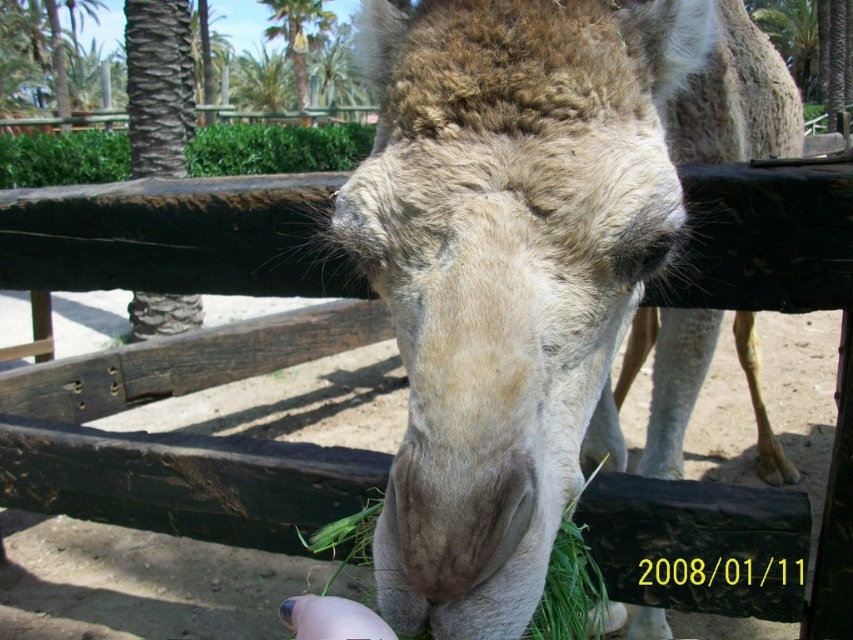
You are standing in front of the camel and want to take a photo. You notice two points marked in the scene. The first point is at coordinate point (495, 403) and the second is at point (318, 0). Which point is closer to your camera?

Point (495, 403) is closer to the camera than point (318, 0).

You are a zookeeper trying to place a new feeding station for the fuzzy beige camel at center. The station needs to be placed 0.3 meters to the right of the camel. Given the camel is at coordinates 0.403, 0.619, where should the feeding station be placed?

The feeding station should be placed at coordinates (527, 449) since the fuzzy beige camel at center is located at point (527, 257) and moving 0.3 meters to the right would add to the x coordinate.